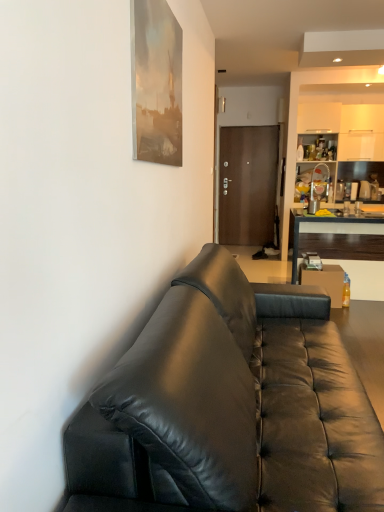
Question: Does dark wood desk at right have a smaller size compared to matte silver cup at center?

Choices:
 (A) no
 (B) yes

Answer: (A)

Question: Is dark wood desk at right turned away from matte silver cup at center?

Choices:
 (A) yes
 (B) no

Answer: (B)

Question: Can you confirm if dark wood desk at right is bigger than matte silver cup at center?

Choices:
 (A) yes
 (B) no

Answer: (A)

Question: From the image's perspective, would you say dark wood desk at right is positioned over matte silver cup at center?

Choices:
 (A) yes
 (B) no

Answer: (B)

Question: Is dark wood desk at right to the left of matte silver cup at center from the viewer's perspective?

Choices:
 (A) no
 (B) yes

Answer: (A)

Question: Based on their positions, is dark wood desk at right located to the left or right of translucent plastic bottle at right?

Choices:
 (A) right
 (B) left

Answer: (A)

Question: Is dark wood desk at right in front of or behind translucent plastic bottle at right in the image?

Choices:
 (A) front
 (B) behind

Answer: (B)

Question: Is point (357, 250) closer or farther from the camera than point (344, 301)?

Choices:
 (A) closer
 (B) farther

Answer: (B)

Question: In terms of width, does dark wood desk at right look wider or thinner when compared to translucent plastic bottle at right?

Choices:
 (A) thin
 (B) wide

Answer: (B)

Question: In the image, is black leather couch at center positioned in front of or behind matte wood cabinet at upper right?

Choices:
 (A) behind
 (B) front

Answer: (B)

Question: From the image's perspective, is black leather couch at center located above or below matte wood cabinet at upper right?

Choices:
 (A) below
 (B) above

Answer: (A)

Question: From a real-world perspective, is black leather couch at center positioned above or below matte wood cabinet at upper right?

Choices:
 (A) above
 (B) below

Answer: (B)

Question: Looking at their shapes, would you say black leather couch at center is wider or thinner than matte wood cabinet at upper right?

Choices:
 (A) wide
 (B) thin

Answer: (A)

Question: From a real-world perspective, is matte silver cup at center physically located above or below dark wood desk at right?

Choices:
 (A) below
 (B) above

Answer: (B)

Question: Is matte silver cup at center situated inside dark wood desk at right or outside?

Choices:
 (A) inside
 (B) outside

Answer: (B)